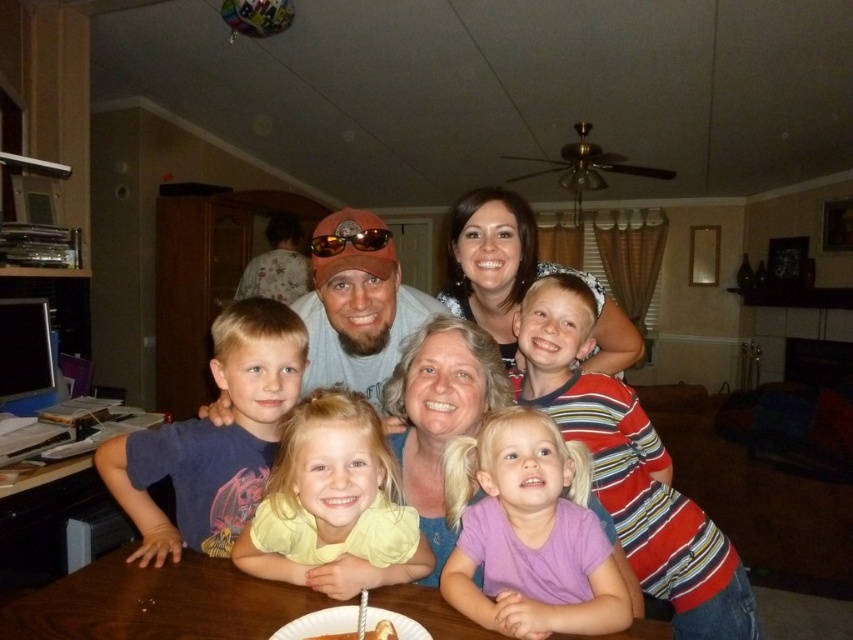
You are standing in the living room and see the point at coordinates [213,438]. What object is located at that point?

The point at coordinates [213,438] corresponds to the dark blue t shirt at left.

You are a photographer setting up for a birthday photo. You need to position a new camera stand to the left of the brown wooden table at lower left. Will the purple cotton shirt at lower center be in the way of the camera stand?

The purple cotton shirt at lower center is to the right of the brown wooden table at lower left, so placing the camera stand to the left of the brown wooden table at lower left would not interfere with the purple cotton shirt at lower center since it is positioned to the right side of the table.